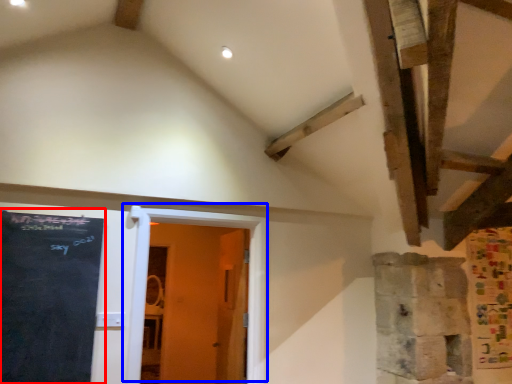
Question: Which object appears closest to the camera in this image, bulletin board (highlighted by a red box) or door (highlighted by a blue box)?

Choices:
 (A) bulletin board
 (B) door

Answer: (A)